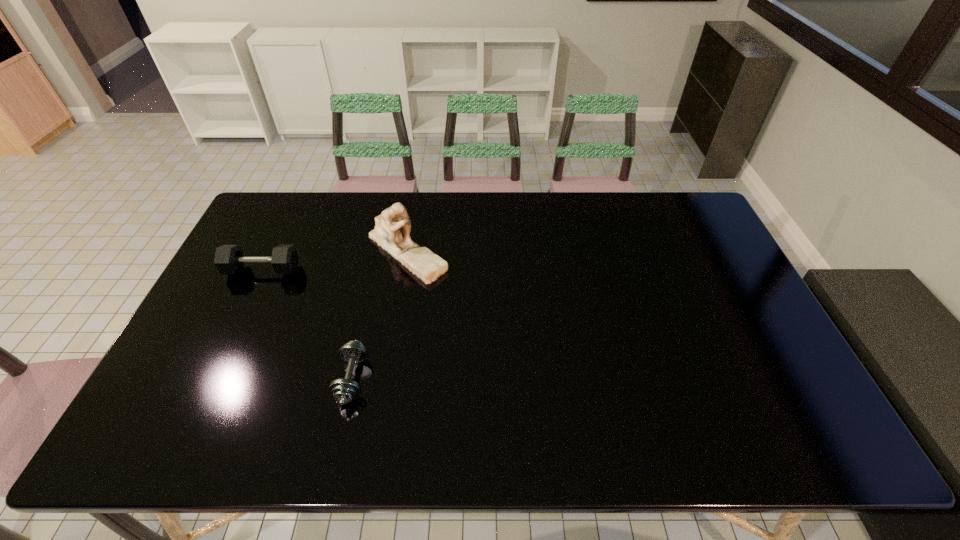
The image size is (960, 540). In order to click on figurine in this screenshot , I will do `click(392, 229)`.

In order to click on the taller dumbbell in this screenshot , I will do `click(229, 259)`.

The image size is (960, 540). What are the coordinates of `the second tallest object` in the screenshot? It's located at (229, 259).

Identify the location of the nearer dumbbell. Image resolution: width=960 pixels, height=540 pixels. (345, 390).

Identify the location of the shorter dumbbell. The height and width of the screenshot is (540, 960). (345, 390).

At what (x,y) coordinates should I click in order to perform the action: click on free space located on the front-facing side of the tallest object. Please return your answer as a coordinate pair (x, y). This screenshot has width=960, height=540. Looking at the image, I should click on (381, 405).

Where is `free region located 0.210m on the right of the taller dumbbell`? The width and height of the screenshot is (960, 540). free region located 0.210m on the right of the taller dumbbell is located at coordinates (366, 271).

At what (x,y) coordinates should I click in order to perform the action: click on vacant area situated 0.350m on the right of the shorter dumbbell. Please return your answer as a coordinate pair (x, y). Looking at the image, I should click on (506, 379).

This screenshot has height=540, width=960. I want to click on object located in the far edge section of the desktop, so click(392, 229).

This screenshot has width=960, height=540. Find the location of `object that is at the left edge`. object that is at the left edge is located at coordinates (229, 259).